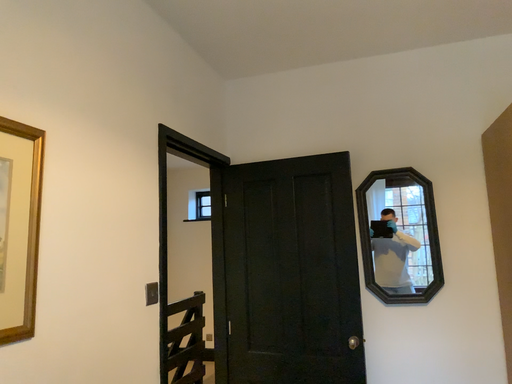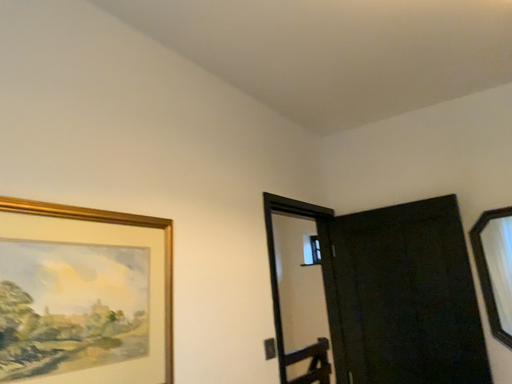
Question: Which way did the camera rotate in the video?

Choices:
 (A) rotated left
 (B) rotated right

Answer: (A)